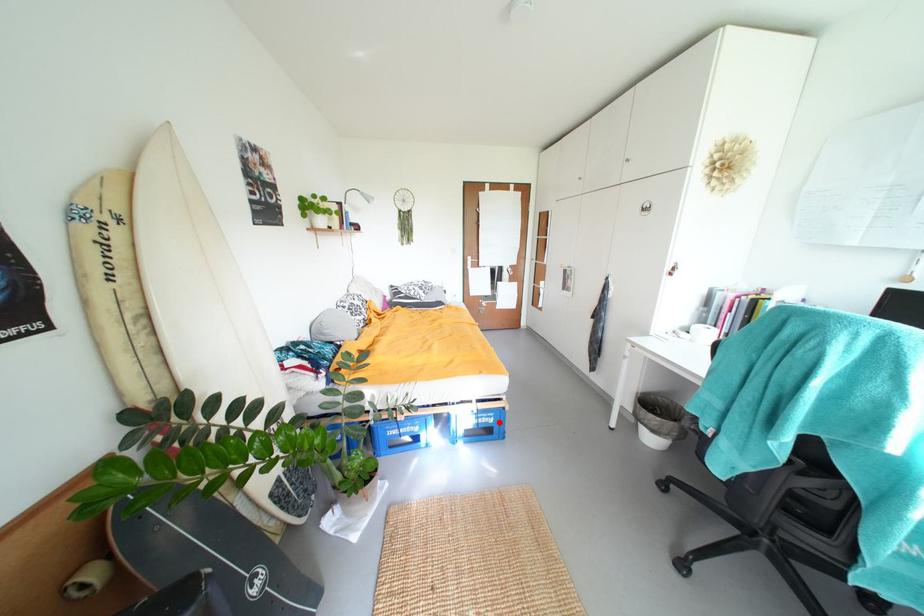
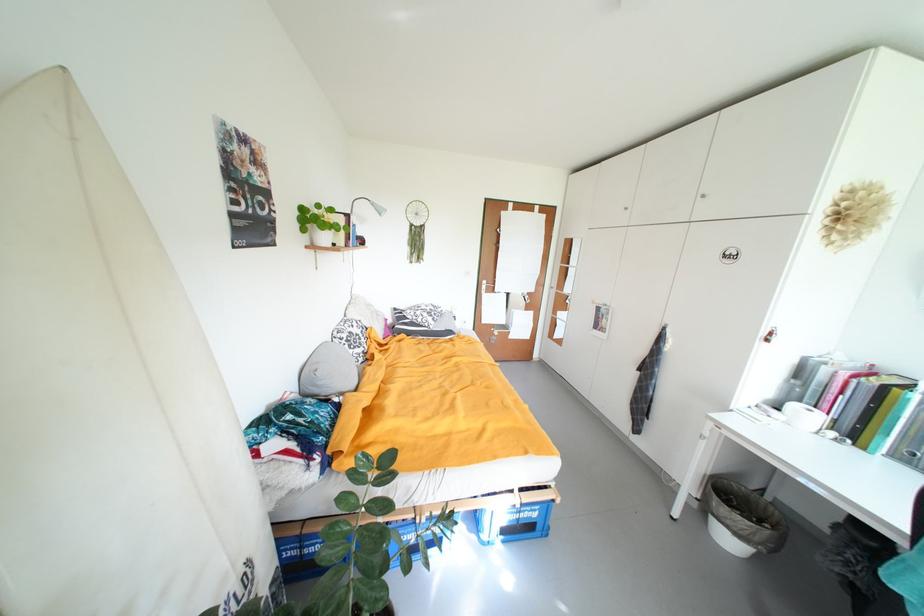
Question: I am providing you with two images of the same scene from different viewpoints. Image1 has a red point marked. In image2, the corresponding 3D location appears at what relative position? Reply with the corresponding letter.

Choices:
 (A) Closer
 (B) Farther

Answer: (A)